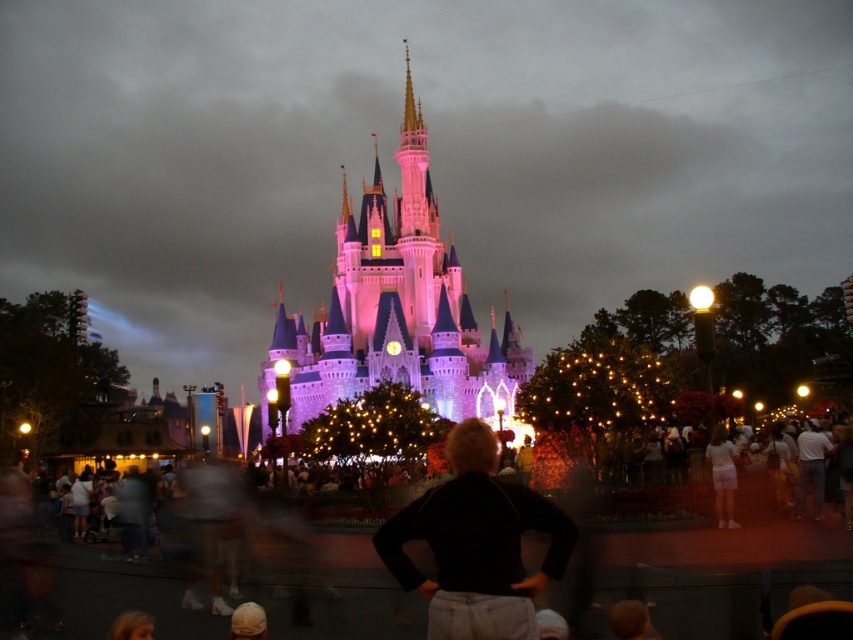
Question: Is pink glossy castle at center thinner than black cotton shirt at center?

Choices:
 (A) yes
 (B) no

Answer: (B)

Question: From the image, what is the correct spatial relationship of black cotton shirt at center in relation to white cotton dress at center?

Choices:
 (A) above
 (B) below

Answer: (A)

Question: Can you confirm if pink glossy castle at center is positioned above white cotton dress at center?

Choices:
 (A) yes
 (B) no

Answer: (A)

Question: Which object is the farthest from the black cotton shirt at center?

Choices:
 (A) white cotton dress at center
 (B) pink glossy castle at center

Answer: (A)

Question: Which object is closer to the camera taking this photo?

Choices:
 (A) black cotton shirt at center
 (B) white cotton dress at center
 (C) pink glossy castle at center

Answer: (A)

Question: Which of the following is the closest to the observer?

Choices:
 (A) (457, 621)
 (B) (724, 465)

Answer: (A)